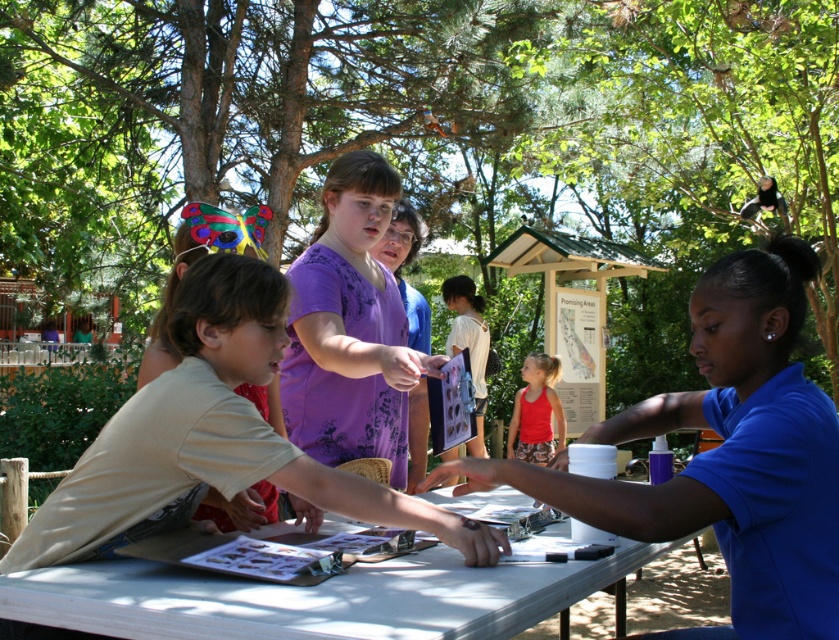
You are organizing an outdoor event and need to ensure that the blue shirt at center and the white plastic table at center are visible to all attendees. Based on their positions, which object is more likely to block the view of the other?

The blue shirt at center is positioned over the white plastic table at center, so the blue shirt at center may block the view of the white plastic table at center.

Looking at this image, you are standing at the edge of the scene and need to locate the blue shirt at center. According to the coordinates provided, in which direction should you look to find it?

The blue shirt at center is located at coordinates point (727,454). Since the x and y values are both above 0.5, it is positioned towards the lower right quadrant of the scene.